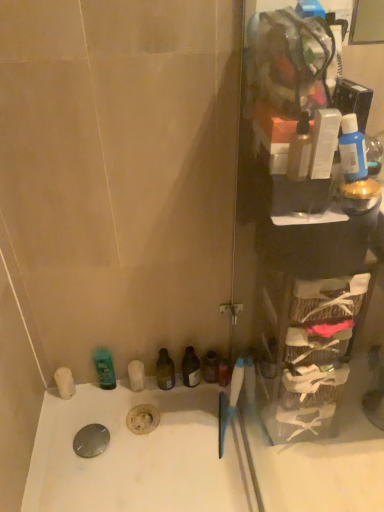
This screenshot has width=384, height=512. Find the location of `purple matte bottle at lower center, the third mouthwash viewed from the left`. purple matte bottle at lower center, the third mouthwash viewed from the left is located at coordinates (210, 366).

What do you see at coordinates (300, 150) in the screenshot? This screenshot has width=384, height=512. I see `translucent plastic bottle at upper right, the 2th mouthwash from the top` at bounding box center [300, 150].

This screenshot has width=384, height=512. What do you see at coordinates (64, 382) in the screenshot?
I see `white matte soap at lower left, which ranks as the 2th toiletry in right-to-left order` at bounding box center [64, 382].

The height and width of the screenshot is (512, 384). Identify the location of blue glossy bottle at upper right, which is the 1th mouthwash from top to bottom. (352, 150).

I want to click on transparent glass bottle at lower center, which is the 3th mouthwash from front to back, so click(x=165, y=370).

In order to face white plastic bottle at upper right, the first toiletry positioned from the right, should I rotate leftwards or rightwards?

A 17.246 degree turn to the right will do.

Where is `blue plastic brush at right`? blue plastic brush at right is located at coordinates (229, 402).

Which object is more forward, blue glossy bottle at upper right, which is counted as the 2th mouthwash, starting from the front, or white plastic bottle at upper right, which is the 2th toiletry from back to front?

white plastic bottle at upper right, which is the 2th toiletry from back to front.

Is blue glossy bottle at upper right, which is counted as the 2th mouthwash, starting from the front, positioned far away from white plastic bottle at upper right, the 1th toiletry from the front?

Actually, blue glossy bottle at upper right, which is counted as the 2th mouthwash, starting from the front, and white plastic bottle at upper right, the 1th toiletry from the front, are a little close together.

Is blue glossy bottle at upper right, which is the fifth mouthwash from bottom to top, to the left of white plastic bottle at upper right, the first toiletry positioned from the right, from the viewer's perspective?

No, blue glossy bottle at upper right, which is the fifth mouthwash from bottom to top, is not to the left of white plastic bottle at upper right, the first toiletry positioned from the right.

From the image's perspective, which one is positioned higher, blue glossy bottle at upper right, acting as the 1th mouthwash starting from the right, or white plastic bottle at upper right, which is counted as the second toiletry, starting from the bottom?

blue glossy bottle at upper right, acting as the 1th mouthwash starting from the right, is shown above in the image.

Does white plastic bottle at upper right, the 1th toiletry in the top-to-bottom sequence, lie behind blue plastic brush at right?

No.

Which of these two, white plastic bottle at upper right, which is counted as the second toiletry, starting from the bottom, or blue plastic brush at right, stands taller?

blue plastic brush at right.

Does point (318, 111) come behind point (234, 412)?

No, (318, 111) is in front of (234, 412).

Is white plastic bottle at upper right, the first toiletry positioned from the right, touching blue plastic brush at right?

There is a gap between white plastic bottle at upper right, the first toiletry positioned from the right, and blue plastic brush at right.

Is point (213, 375) more distant than point (298, 162)?

Yes, it is behind point (298, 162).

Can you confirm if purple matte bottle at lower center, which ranks as the fifth mouthwash in front-to-back order, is positioned to the right of translucent plastic bottle at upper right, the 2th mouthwash from the top?

No.

Considering the sizes of purple matte bottle at lower center, which is the 4th mouthwash from top to bottom, and translucent plastic bottle at upper right, which ranks as the second mouthwash in right-to-left order, in the image, is purple matte bottle at lower center, which is the 4th mouthwash from top to bottom, bigger or smaller than translucent plastic bottle at upper right, which ranks as the second mouthwash in right-to-left order,?

Considering their sizes, purple matte bottle at lower center, which is the 4th mouthwash from top to bottom, takes up more space than translucent plastic bottle at upper right, which ranks as the second mouthwash in right-to-left order.

Is purple matte bottle at lower center, the 2th mouthwash ordered from the bottom, aimed at translucent plastic bottle at upper right, which ranks as the second mouthwash in right-to-left order?

No.

Who is taller, white matte soap at lower left, which is the 2th toiletry in top-to-bottom order, or transparent glass bottle at lower center, marked as the third mouthwash in a top-to-bottom arrangement?

transparent glass bottle at lower center, marked as the third mouthwash in a top-to-bottom arrangement, is taller.

How different are the orientations of white matte soap at lower left, marked as the 1th toiletry in a bottom-to-top arrangement, and transparent glass bottle at lower center, which is counted as the 3th mouthwash, starting from the back, in degrees?

They differ by 1.05 degrees in their facing directions.

Consider the image. From a real-world perspective, is white matte soap at lower left, which is the second toiletry in front-to-back order, above or below transparent glass bottle at lower center, marked as the third mouthwash in a top-to-bottom arrangement?

white matte soap at lower left, which is the second toiletry in front-to-back order, is below transparent glass bottle at lower center, marked as the third mouthwash in a top-to-bottom arrangement.

From the image's perspective, between white matte soap at lower left, which is the 2th toiletry in top-to-bottom order, and transparent glass bottle at lower center, positioned as the 4th mouthwash in right-to-left order, who is located below?

white matte soap at lower left, which is the 2th toiletry in top-to-bottom order, is shown below in the image.

At what (x,y) coordinates should I click in order to perform the action: click on brush directly beneath the transparent plastic shelf at right (from a real-world perspective). Please return your answer as a coordinate pair (x, y). Looking at the image, I should click on (229, 402).

Considering the sizes of objects transparent plastic shelf at right and blue plastic brush at right in the image provided, who is taller, transparent plastic shelf at right or blue plastic brush at right?

Standing taller between the two is transparent plastic shelf at right.

Which object is thinner, transparent plastic shelf at right or blue plastic brush at right?

Thinner between the two is blue plastic brush at right.

What's the angular difference between transparent plastic shelf at right and blue plastic brush at right's facing directions?

The angular difference between transparent plastic shelf at right and blue plastic brush at right is 10.4 degrees.

How many degrees apart are the facing directions of blue plastic brush at right and translucent plastic bottle at upper right, marked as the fourth mouthwash in a left-to-right arrangement?

The angle between the facing direction of blue plastic brush at right and the facing direction of translucent plastic bottle at upper right, marked as the fourth mouthwash in a left-to-right arrangement, is 12.9 degrees.

Is blue plastic brush at right looking in the opposite direction of translucent plastic bottle at upper right, the 2th mouthwash from the top?

blue plastic brush at right is not turned away from translucent plastic bottle at upper right, the 2th mouthwash from the top.

Considering the relative sizes of blue plastic brush at right and translucent plastic bottle at upper right, marked as the fourth mouthwash in a left-to-right arrangement, in the image provided, is blue plastic brush at right wider than translucent plastic bottle at upper right, marked as the fourth mouthwash in a left-to-right arrangement,?

Correct, the width of blue plastic brush at right exceeds that of translucent plastic bottle at upper right, marked as the fourth mouthwash in a left-to-right arrangement.

Is translucent plastic bottle at upper right, marked as the fourth mouthwash in a left-to-right arrangement, not near blue plastic brush at right?

They are positioned close to each other.

From a real-world perspective, who is located lower, translucent plastic bottle at upper right, the first mouthwash viewed from the front, or blue plastic brush at right?

blue plastic brush at right, from a real-world perspective.

From the image's perspective, is translucent plastic bottle at upper right, the first mouthwash viewed from the front, under blue plastic brush at right?

No, from the image's perspective, translucent plastic bottle at upper right, the first mouthwash viewed from the front, is not beneath blue plastic brush at right.

At what (x,y) coordinates should I click in order to perform the action: click on the 1st toiletry positioned below the blue glossy bottle at upper right, which is the fifth mouthwash from bottom to top (from the image's perspective). Please return your answer as a coordinate pair (x, y). This screenshot has width=384, height=512. Looking at the image, I should click on (324, 142).

I want to click on brush behind the white plastic bottle at upper right, the 2th toiletry viewed from the left, so click(x=229, y=402).

Considering their positions, is transparent glass bottle at lower center, which is the 3th mouthwash from front to back, positioned closer to green matte mouthwash at lower left, the 2th mouthwash from the back, than white plastic bottle at upper right, which is the 2th toiletry from back to front?

transparent glass bottle at lower center, which is the 3th mouthwash from front to back.

Which object lies nearer to the anchor point purple matte bottle at lower center, which is the third mouthwash in right-to-left order, translucent plastic bottle at upper right, acting as the 4th mouthwash starting from the bottom, or transparent plastic shelf at right?

Based on the image, transparent plastic shelf at right appears to be nearer to purple matte bottle at lower center, which is the third mouthwash in right-to-left order.

Based on the photo, looking at the image, which one is located closer to white matte soap at lower left, positioned as the 1th toiletry in back-to-front order, blue glossy bottle at upper right, which is counted as the 4th mouthwash, starting from the back, or green matte mouthwash at lower left, the 2th mouthwash from the back?

Among the two, green matte mouthwash at lower left, the 2th mouthwash from the back, is located nearer to white matte soap at lower left, positioned as the 1th toiletry in back-to-front order.

From the image, which object appears to be farther from purple matte bottle at lower center, which ranks as the fifth mouthwash in front-to-back order, translucent plastic bottle at upper right, which ranks as the second mouthwash in right-to-left order, or blue glossy bottle at upper right, which is counted as the 4th mouthwash, starting from the back?

blue glossy bottle at upper right, which is counted as the 4th mouthwash, starting from the back, is further to purple matte bottle at lower center, which ranks as the fifth mouthwash in front-to-back order.

When comparing their distances from transparent plastic shelf at right, does white matte soap at lower left, which is the 2th toiletry in top-to-bottom order, or green matte mouthwash at lower left, positioned as the fifth mouthwash in top-to-bottom order, seem closer?

Based on the image, green matte mouthwash at lower left, positioned as the fifth mouthwash in top-to-bottom order, appears to be nearer to transparent plastic shelf at right.

Considering their positions, is blue glossy bottle at upper right, acting as the 1th mouthwash starting from the right, positioned closer to purple matte bottle at lower center, which ranks as the fifth mouthwash in front-to-back order, than green matte mouthwash at lower left, the first mouthwash viewed from the left?

Among the two, green matte mouthwash at lower left, the first mouthwash viewed from the left, is located nearer to purple matte bottle at lower center, which ranks as the fifth mouthwash in front-to-back order.

Estimate the real-world distances between objects in this image. Which object is closer to purple matte bottle at lower center, which is the third mouthwash in right-to-left order, transparent glass bottle at lower center, positioned as the 4th mouthwash in right-to-left order, or transparent plastic shelf at right?

transparent glass bottle at lower center, positioned as the 4th mouthwash in right-to-left order, is positioned closer to the anchor purple matte bottle at lower center, which is the third mouthwash in right-to-left order.

When comparing their distances from transparent glass bottle at lower center, marked as the third mouthwash in a top-to-bottom arrangement, does green matte mouthwash at lower left, the first mouthwash positioned from the bottom, or transparent plastic shelf at right seem closer?

The object closer to transparent glass bottle at lower center, marked as the third mouthwash in a top-to-bottom arrangement, is green matte mouthwash at lower left, the first mouthwash positioned from the bottom.

The width and height of the screenshot is (384, 512). I want to click on mouthwash located between blue glossy bottle at upper right, which is counted as the 4th mouthwash, starting from the back, and green matte mouthwash at lower left, the 2th mouthwash from the back, in the depth direction, so click(x=165, y=370).

I want to click on toiletry positioned between transparent plastic shelf at right and blue glossy bottle at upper right, which is the 1th mouthwash from top to bottom, from near to far, so click(x=324, y=142).

Identify the location of toiletry between blue glossy bottle at upper right, which is counted as the 2th mouthwash, starting from the front, and purple matte bottle at lower center, the third mouthwash viewed from the left, along the z-axis. (64, 382).

The width and height of the screenshot is (384, 512). I want to click on toiletry between translucent plastic bottle at upper right, acting as the 4th mouthwash starting from the bottom, and blue glossy bottle at upper right, which is the 1th mouthwash from top to bottom, from left to right, so click(x=324, y=142).